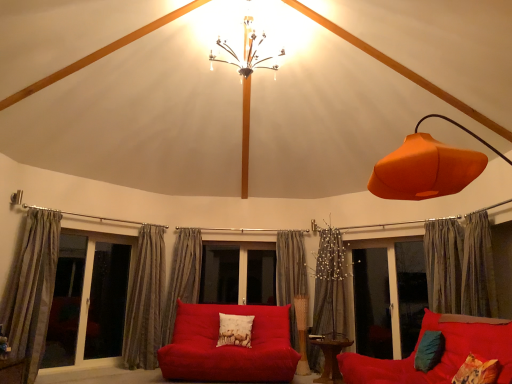
Question: Which direction should I rotate to look at printed fabric pillow at center, the third pillow when ordered from left to right, — up or down?

Choices:
 (A) up
 (B) down

Answer: (B)

Question: Does wooden table at center appear on the left side of matte red couch at lower right, placed as the first studio couch when sorted from right to left?

Choices:
 (A) no
 (B) yes

Answer: (B)

Question: From a real-world perspective, is wooden table at center physically above matte red couch at lower right, placed as the first studio couch when sorted from right to left?

Choices:
 (A) no
 (B) yes

Answer: (A)

Question: Can you confirm if wooden table at center is shorter than matte red couch at lower right, the second studio couch in the back-to-front sequence?

Choices:
 (A) yes
 (B) no

Answer: (A)

Question: From the image's perspective, is wooden table at center below matte red couch at lower right, placed as the first studio couch when sorted from right to left?

Choices:
 (A) yes
 (B) no

Answer: (A)

Question: Is wooden table at center not close to matte red couch at lower right, which ranks as the second studio couch in left-to-right order?

Choices:
 (A) no
 (B) yes

Answer: (A)

Question: Is wooden table at center beside matte red couch at lower right, which ranks as the second studio couch in left-to-right order?

Choices:
 (A) no
 (B) yes

Answer: (A)

Question: From the image's perspective, is transparent glass screen door at center, positioned as the second screen door in left-to-right order, located beneath silky gray curtain at center, the 2th curtain viewed from the right?

Choices:
 (A) yes
 (B) no

Answer: (A)

Question: From a real-world perspective, is transparent glass screen door at center, acting as the first screen door starting from the right, positioned under silky gray curtain at center, the 2th curtain viewed from the right, based on gravity?

Choices:
 (A) yes
 (B) no

Answer: (A)

Question: Is transparent glass screen door at center, acting as the first screen door starting from the right, bigger than silky gray curtain at center, acting as the fifth curtain starting from the left?

Choices:
 (A) no
 (B) yes

Answer: (A)

Question: Considering the relative positions of transparent glass screen door at center, positioned as the second screen door in left-to-right order, and silky gray curtain at center, the 2th curtain viewed from the right, in the image provided, is transparent glass screen door at center, positioned as the second screen door in left-to-right order, to the left of silky gray curtain at center, the 2th curtain viewed from the right, from the viewer's perspective?

Choices:
 (A) no
 (B) yes

Answer: (A)

Question: Is transparent glass screen door at center, positioned as the second screen door in left-to-right order, looking in the opposite direction of silky gray curtain at center, the 2th curtain viewed from the right?

Choices:
 (A) yes
 (B) no

Answer: (B)

Question: Is transparent glass screen door at center, acting as the first screen door starting from the right, to the right of silky gray curtain at center, the 2th curtain viewed from the right, from the viewer's perspective?

Choices:
 (A) yes
 (B) no

Answer: (A)

Question: Considering the relative positions of silky gray curtain at right, arranged as the 6th curtain when viewed from the left, and matte glass window at left in the image provided, is silky gray curtain at right, arranged as the 6th curtain when viewed from the left, in front of matte glass window at left?

Choices:
 (A) yes
 (B) no

Answer: (A)